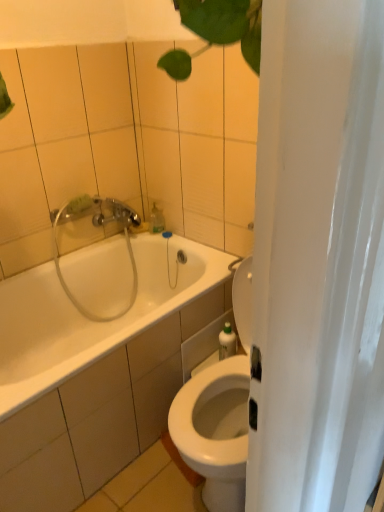
The height and width of the screenshot is (512, 384). What do you see at coordinates (92, 307) in the screenshot?
I see `white glossy bathtub at center` at bounding box center [92, 307].

What is the approximate width of translucent plastic soap dispenser at upper center?

It is 3.62 inches.

Image resolution: width=384 pixels, height=512 pixels. Identify the location of white glossy bathtub at center. (92, 307).

Considering the points (161, 219) and (117, 217), which point is in front, point (161, 219) or point (117, 217)?

The point (117, 217) is in front.

Is translucent plastic soap dispenser at upper center positioned before clear plastic showerhead at upper left?

That is False.

Is translucent plastic soap dispenser at upper center oriented towards clear plastic showerhead at upper left?

No, translucent plastic soap dispenser at upper center does not turn towards clear plastic showerhead at upper left.

In terms of width, does clear plastic showerhead at upper left look wider or thinner when compared to white glossy bathtub at center?

clear plastic showerhead at upper left is thinner than white glossy bathtub at center.

Is clear plastic showerhead at upper left with white glossy bathtub at center?

No, clear plastic showerhead at upper left is not in contact with white glossy bathtub at center.

Is white glossy bathtub at center at the back of clear plastic showerhead at upper left?

Yes, clear plastic showerhead at upper left is facing away from white glossy bathtub at center.

From the image's perspective, which object appears higher, clear plastic showerhead at upper left or white glossy bathtub at center?

clear plastic showerhead at upper left appears higher in the image.

Are white glossy bathtub at center and translucent plastic soap dispenser at upper center located far from each other?

They are positioned close to each other.

Based on the photo, is the depth of white glossy bathtub at center greater than that of translucent plastic soap dispenser at upper center?

No, it is not.

Between white glossy bathtub at center and translucent plastic soap dispenser at upper center, which one has more height?

white glossy bathtub at center.

Considering the points (71, 366) and (233, 338), which point is behind, point (71, 366) or point (233, 338)?

The point (233, 338) is farther.

Who is taller, white glossy bathtub at center or green plastic bottle at right?

With more height is white glossy bathtub at center.

Is green plastic bottle at right at the back of white glossy bathtub at center?

white glossy bathtub at center is not turned away from green plastic bottle at right.

Considering the positions of objects white glossy bathtub at center and green plastic bottle at right in the image provided, who is behind, white glossy bathtub at center or green plastic bottle at right?

green plastic bottle at right is behind.

How different are the orientations of translucent plastic soap dispenser at upper center and white glossy bathtub at center in degrees?

0.00625 degrees separate the facing orientations of translucent plastic soap dispenser at upper center and white glossy bathtub at center.

Considering the positions of objects translucent plastic soap dispenser at upper center and white glossy bathtub at center in the image provided, who is in front, translucent plastic soap dispenser at upper center or white glossy bathtub at center?

Answer: Positioned in front is white glossy bathtub at center.

Does translucent plastic soap dispenser at upper center have a larger size compared to white glossy bathtub at center?

No.

Looking at their sizes, would you say translucent plastic soap dispenser at upper center is wider or thinner than white glossy bathtub at center?

Clearly, translucent plastic soap dispenser at upper center has less width compared to white glossy bathtub at center.

From the image's perspective, which is below, green plastic bottle at right or white glossy bathtub at center?

white glossy bathtub at center, from the image's perspective.

Does green plastic bottle at right turn towards white glossy bathtub at center?

No, green plastic bottle at right is not aimed at white glossy bathtub at center.

In the scene shown: From a real-world perspective, who is located higher, green plastic bottle at right or white glossy bathtub at center?

From a 3D spatial view, green plastic bottle at right is above.

Are white glossy bathtub at center and clear plastic showerhead at upper left located far from each other?

They are positioned close to each other.

Is clear plastic showerhead at upper left surrounded by white glossy bathtub at center?

Yes.

Looking at this image, is white glossy bathtub at center oriented towards clear plastic showerhead at upper left?

No, white glossy bathtub at center does not turn towards clear plastic showerhead at upper left.

Which object is closer to the camera taking this photo, white glossy bathtub at center or clear plastic showerhead at upper left?

white glossy bathtub at center.

At what (x,y) coordinates should I click in order to perform the action: click on soap dispenser behind the clear plastic showerhead at upper left. Please return your answer as a coordinate pair (x, y). This screenshot has height=512, width=384. Looking at the image, I should click on (157, 220).

Identify the location of bathtub that appears below the clear plastic showerhead at upper left (from a real-world perspective). The image size is (384, 512). (92, 307).

Estimate the real-world distances between objects in this image. Which object is closer to green plastic bottle at right, white glossy bathtub at center or clear plastic showerhead at upper left?

white glossy bathtub at center is closer to green plastic bottle at right.

Which object lies nearer to the anchor point green plastic bottle at right, translucent plastic soap dispenser at upper center or white glossy bathtub at center?

white glossy bathtub at center is closer to green plastic bottle at right.

Which object lies nearer to the anchor point green plastic bottle at right, clear plastic showerhead at upper left or translucent plastic soap dispenser at upper center?

translucent plastic soap dispenser at upper center is positioned closer to the anchor green plastic bottle at right.

Which object lies further to the anchor point translucent plastic soap dispenser at upper center, white glossy bathtub at center or clear plastic showerhead at upper left?

white glossy bathtub at center is positioned further to the anchor translucent plastic soap dispenser at upper center.

Which object lies nearer to the anchor point translucent plastic soap dispenser at upper center, green plastic bottle at right or clear plastic showerhead at upper left?

The object closer to translucent plastic soap dispenser at upper center is clear plastic showerhead at upper left.

Consider the image. Estimate the real-world distances between objects in this image. Which object is closer to translucent plastic soap dispenser at upper center, green plastic bottle at right or white glossy bathtub at center?

white glossy bathtub at center is closer to translucent plastic soap dispenser at upper center.

Consider the image. From the image, which object appears to be farther from clear plastic showerhead at upper left, translucent plastic soap dispenser at upper center or green plastic bottle at right?

Based on the image, green plastic bottle at right appears to be further to clear plastic showerhead at upper left.

Which object lies further to the anchor point white glossy bathtub at center, clear plastic showerhead at upper left or green plastic bottle at right?

Based on the image, green plastic bottle at right appears to be further to white glossy bathtub at center.

Identify the location of shower between translucent plastic soap dispenser at upper center and green plastic bottle at right in the vertical direction. The width and height of the screenshot is (384, 512). (93, 237).

This screenshot has width=384, height=512. Identify the location of toiletry positioned between white glossy bathtub at center and clear plastic showerhead at upper left from near to far. (227, 342).

I want to click on toiletry located between white glossy bathtub at center and translucent plastic soap dispenser at upper center in the depth direction, so click(227, 342).

Identify the location of shower positioned between white glossy bathtub at center and translucent plastic soap dispenser at upper center from near to far. (93, 237).